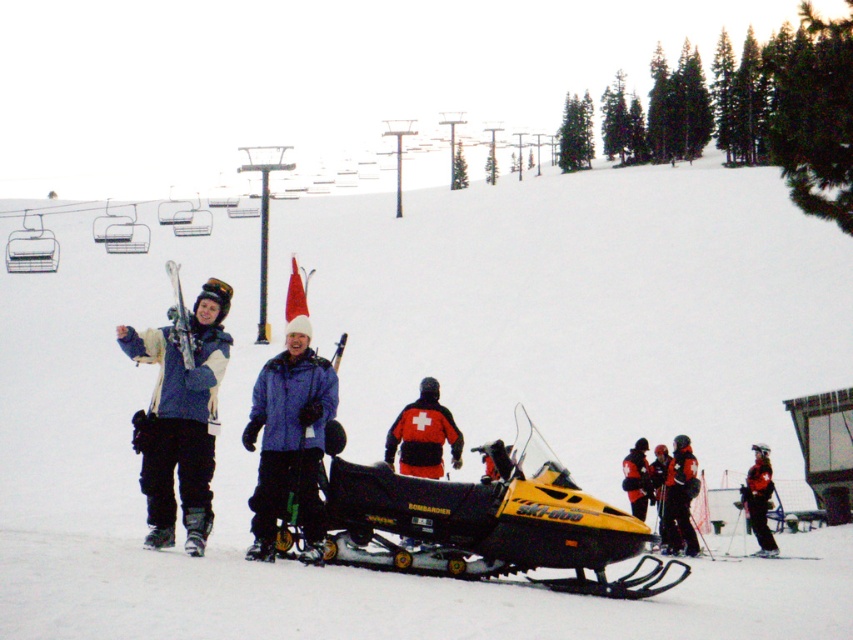
Question: Is matte blue jacket at left to the left of red reflective jacket at center from the viewer's perspective?

Choices:
 (A) yes
 (B) no

Answer: (A)

Question: Which of the following is the closest to the observer?

Choices:
 (A) red ski suit at center
 (B) black fabric jacket at center

Answer: (A)

Question: Does red reflective jacket at center have a lesser width compared to black fabric jacket at center?

Choices:
 (A) no
 (B) yes

Answer: (B)

Question: Which is farther from the black ski pants at center?

Choices:
 (A) black fabric jacket at center
 (B) red reflective jacket at center
 (C) matte blue jacket at left
 (D) blue matte jacket at center

Answer: (C)

Question: Is blue matte jacket at center positioned in front of red ski suit at center?

Choices:
 (A) no
 (B) yes

Answer: (B)

Question: Which is farther from the matte blue jacket at left?

Choices:
 (A) black fabric jacket at center
 (B) blue matte jacket at center
 (C) red reflective jacket at center

Answer: (C)